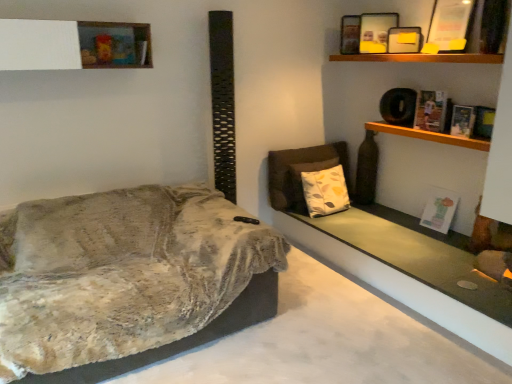
Question: Is white matte shelf at upper left, the first shelf positioned from the left, bigger than wooden shelf at upper right, which is the 1th shelf from right to left?

Choices:
 (A) no
 (B) yes

Answer: (B)

Question: Is white matte shelf at upper left, the 1th shelf when ordered from top to bottom, in contact with wooden shelf at upper right, the 2th shelf positioned from the top?

Choices:
 (A) no
 (B) yes

Answer: (A)

Question: Can you confirm if white matte shelf at upper left, the 2th shelf positioned from the bottom, is smaller than wooden shelf at upper right, the first shelf ordered from the bottom?

Choices:
 (A) no
 (B) yes

Answer: (A)

Question: Could wooden shelf at upper right, which ranks as the second shelf in left-to-right order, be considered to be inside white matte shelf at upper left, marked as the 2th shelf in a right-to-left arrangement?

Choices:
 (A) yes
 (B) no

Answer: (B)

Question: Is white matte shelf at upper left, the 2th shelf positioned from the bottom, thinner than wooden shelf at upper right, the 2th shelf positioned from the top?

Choices:
 (A) no
 (B) yes

Answer: (A)

Question: Is hardcover book at upper right, the 3th book when ordered from top to bottom, wider or thinner than hardcover book at upper right, the 2th book positioned from the top?

Choices:
 (A) thin
 (B) wide

Answer: (A)

Question: Is point (482, 107) positioned closer to the camera than point (453, 120)?

Choices:
 (A) farther
 (B) closer

Answer: (B)

Question: Is hardcover book at upper right, the 3th book when ordered from top to bottom, in front of or behind hardcover book at upper right, the 2th book positioned from the top, in the image?

Choices:
 (A) front
 (B) behind

Answer: (A)

Question: From a real-world perspective, is hardcover book at upper right, placed as the second book when sorted from bottom to top, positioned above or below hardcover book at upper right, marked as the 3th book in a bottom-to-top arrangement?

Choices:
 (A) above
 (B) below

Answer: (B)

Question: Does point (375, 122) appear closer or farther from the camera than point (438, 120)?

Choices:
 (A) closer
 (B) farther

Answer: (B)

Question: Considering the positions of wooden shelf at upper right, which is the 1th shelf from right to left, and matte paper book at upper right, the fourth book when ordered from bottom to top, in the image, is wooden shelf at upper right, which is the 1th shelf from right to left, taller or shorter than matte paper book at upper right, the fourth book when ordered from bottom to top,?

Choices:
 (A) short
 (B) tall

Answer: (A)

Question: Is wooden shelf at upper right, which ranks as the second shelf in left-to-right order, inside the boundaries of matte paper book at upper right, which appears as the 1th book when viewed from the top, or outside?

Choices:
 (A) outside
 (B) inside

Answer: (A)

Question: From a real-world perspective, relative to matte paper book at upper right, the fourth book when ordered from bottom to top, is wooden shelf at upper right, the first shelf ordered from the bottom, vertically above or below?

Choices:
 (A) below
 (B) above

Answer: (A)

Question: Visually, is white matte shelf at upper left, marked as the 2th shelf in a right-to-left arrangement, positioned to the left or to the right of hardcover book at upper right, placed as the second book when sorted from bottom to top?

Choices:
 (A) left
 (B) right

Answer: (A)

Question: Is white matte shelf at upper left, the 1th shelf when ordered from top to bottom, bigger or smaller than hardcover book at upper right, the 3th book when ordered from top to bottom?

Choices:
 (A) big
 (B) small

Answer: (A)